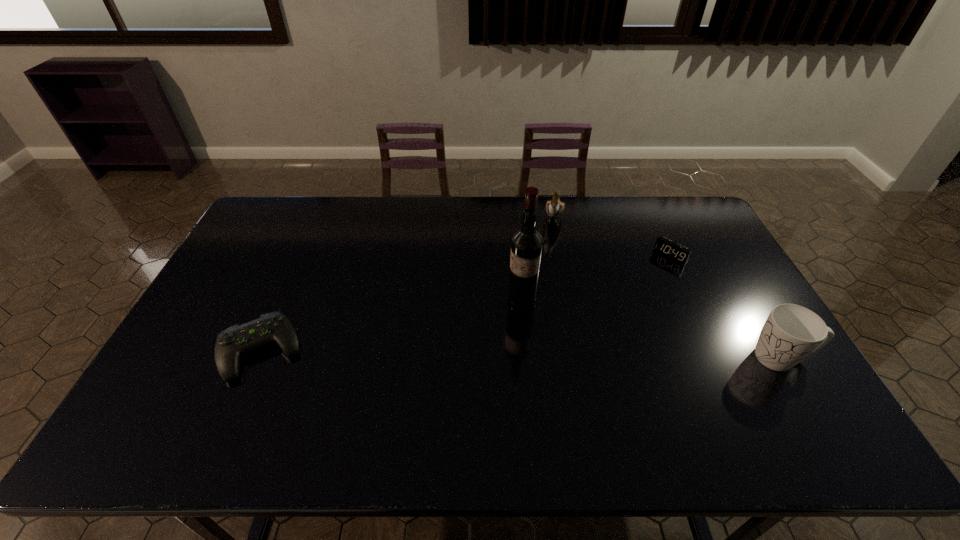
The width and height of the screenshot is (960, 540). I want to click on the leftmost object, so click(236, 340).

Where is `mug`? mug is located at coordinates (791, 332).

Where is `bird`? Image resolution: width=960 pixels, height=540 pixels. bird is located at coordinates (554, 208).

Find the location of a particular element. The image size is (960, 540). the farthest object is located at coordinates (554, 208).

The height and width of the screenshot is (540, 960). In order to click on the fourth nearest object in this screenshot , I will do `click(673, 250)`.

The image size is (960, 540). Identify the location of the fourth object from left to right. (673, 250).

Image resolution: width=960 pixels, height=540 pixels. In order to click on the second object from left to right in this screenshot , I will do click(x=527, y=243).

You are a GUI agent. You are given a task and a screenshot of the screen. Output one action in this format:
    pyautogui.click(x=<x>, y=<y>)
    Task: Click on the wine bottle
    The image size is (960, 540).
    Given the screenshot: What is the action you would take?
    pyautogui.click(x=527, y=243)

This screenshot has width=960, height=540. Identify the location of vacant position located 0.140m on the back of the leftmost object. (289, 286).

At what (x,y) coordinates should I click in order to perform the action: click on free space located on the side of the mug with the handle. Please return your answer as a coordinate pair (x, y). Image resolution: width=960 pixels, height=540 pixels. Looking at the image, I should click on (716, 357).